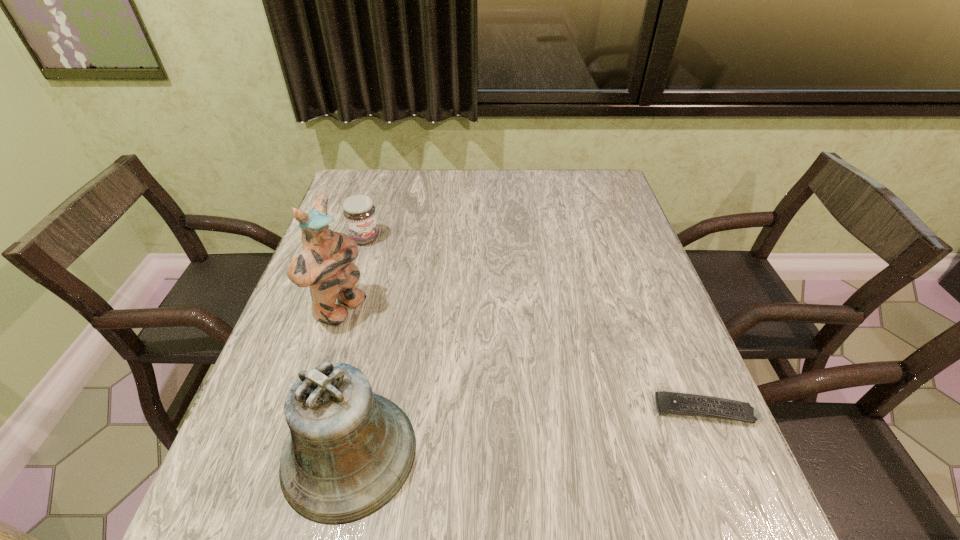
You are a GUI agent. You are given a task and a screenshot of the screen. Output one action in this format:
    pyautogui.click(x=<x>, y=<y>)
    Task: Click on the object that is at the right edge
    Image resolution: width=960 pixels, height=540 pixels.
    Given the screenshot: What is the action you would take?
    pyautogui.click(x=675, y=403)

Find the location of a particular element. object located in the near left corner section of the desktop is located at coordinates (349, 452).

Find the location of a particular element. object that is at the near right corner is located at coordinates (675, 403).

Image resolution: width=960 pixels, height=540 pixels. What are the coordinates of `free space at the far edge` in the screenshot? It's located at (457, 180).

The image size is (960, 540). I want to click on vacant space at the right edge of the desktop, so click(x=589, y=257).

In the image, there is a desktop. In order to click on vacant area at the far right corner in this screenshot , I will do `click(610, 169)`.

This screenshot has height=540, width=960. I want to click on empty space that is in between the rightmost object and the tallest object, so click(x=522, y=360).

The width and height of the screenshot is (960, 540). Identify the location of free area in between the third shortest object and the shortest object. (527, 431).

Where is `free space between the shortest object and the second tallest object`? free space between the shortest object and the second tallest object is located at coordinates (527, 431).

Where is `free space between the bell and the remote control`? The width and height of the screenshot is (960, 540). free space between the bell and the remote control is located at coordinates (527, 431).